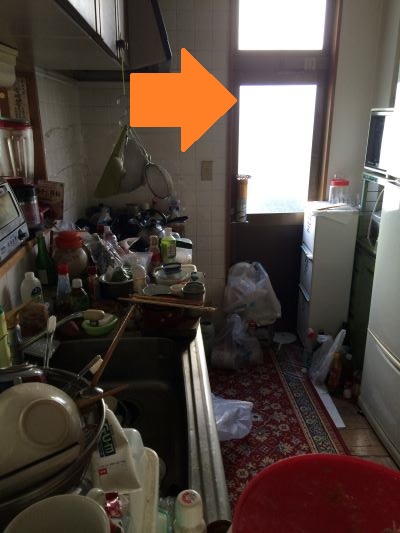
The image size is (400, 533). What are the coordinates of `flooring` in the screenshot? It's located at (354, 440).